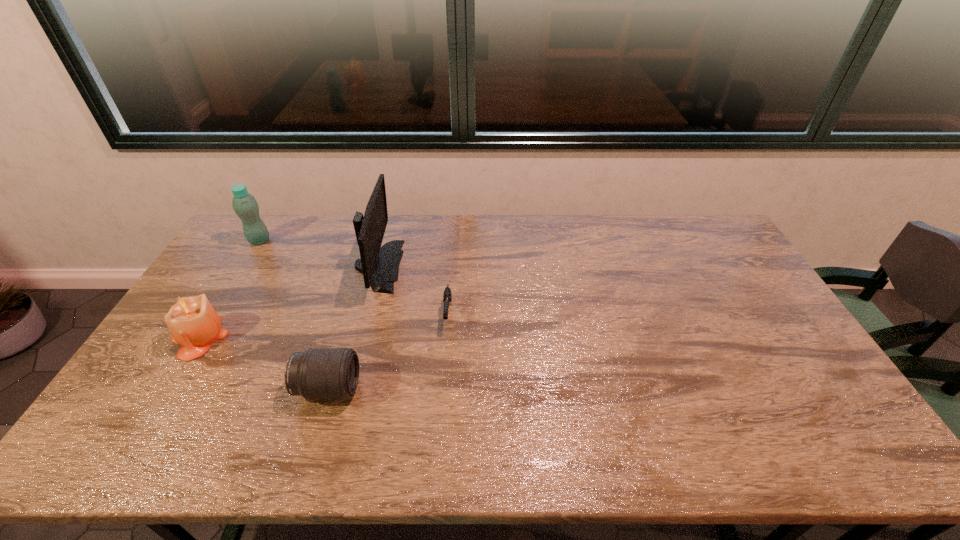
Identify the location of vacant region located on the surface of the telephoto lens. Image resolution: width=960 pixels, height=540 pixels. (389, 388).

This screenshot has width=960, height=540. I want to click on free space located 0.300m at the end of the barrel of the shortest object, so click(440, 428).

Find the location of a particular element. Image resolution: width=960 pixels, height=540 pixels. monitor at the far edge is located at coordinates (379, 265).

Locate an element on the screen. The width and height of the screenshot is (960, 540). water bottle that is positioned at the far edge is located at coordinates tap(245, 206).

You are a GUI agent. You are given a task and a screenshot of the screen. Output one action in this format:
    pyautogui.click(x=<x>, y=<y>)
    Task: Click on the water bottle at the left edge
    
    Given the screenshot: What is the action you would take?
    pyautogui.click(x=245, y=206)

In order to click on candle situated at the left edge in this screenshot , I will do `click(193, 322)`.

Locate an element on the screen. The height and width of the screenshot is (540, 960). object located at the far left corner is located at coordinates (245, 206).

Identify the location of free space at the far edge of the desktop. This screenshot has height=540, width=960. (444, 232).

The width and height of the screenshot is (960, 540). In the image, there is a desktop. In order to click on free space at the far right corner in this screenshot , I will do `click(683, 221)`.

At what (x,y) coordinates should I click in order to perform the action: click on free point between the rightmost object and the monitor. Please return your answer as a coordinate pair (x, y). Looking at the image, I should click on (413, 290).